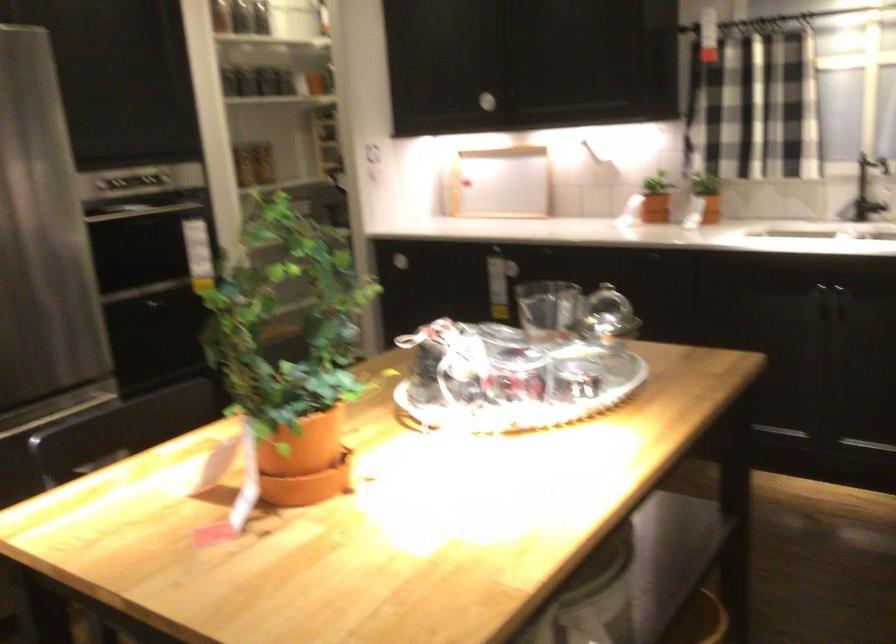
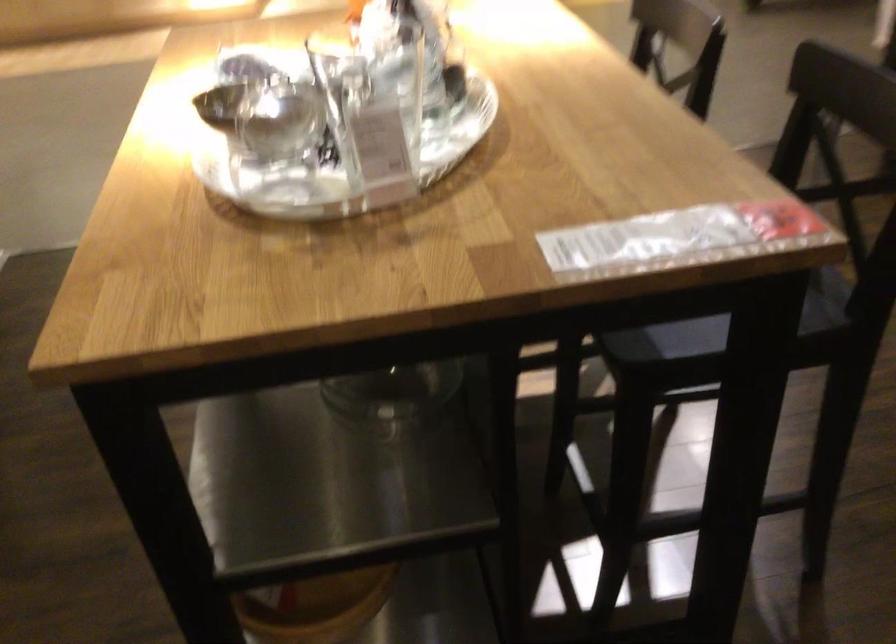
The point at (448,341) is marked in the first image. Where is the corresponding point in the second image?

(371, 29)